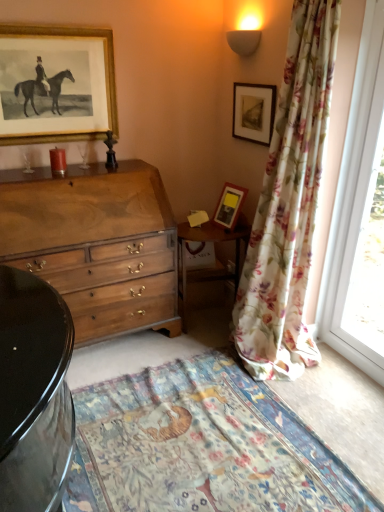
Question: Considering the positions of floral fabric curtain at right and gold-framed print at upper left, which ranks as the 3th picture frame in right-to-left order, in the image, is floral fabric curtain at right bigger or smaller than gold-framed print at upper left, which ranks as the 3th picture frame in right-to-left order,?

Choices:
 (A) big
 (B) small

Answer: (A)

Question: From the image's perspective, is floral fabric curtain at right located above or below gold-framed print at upper left, the first picture frame from the left?

Choices:
 (A) below
 (B) above

Answer: (A)

Question: Considering the real-world distances, which object is closest to the floral fabric curtain at right?

Choices:
 (A) matte wooden picture frame at upper right, the second picture frame in the right-to-left sequence
 (B) floral cotton blanket at lower center
 (C) wooden table at center
 (D) wooden chest of drawers at center
 (E) matte black picture frame at upper right, the 1th picture frame positioned from the right

Answer: (A)

Question: Based on their relative distances, which object is nearer to the wooden table at center?

Choices:
 (A) gold-framed print at upper left, the first picture frame from the left
 (B) matte black picture frame at upper right, acting as the third picture frame starting from the left
 (C) floral fabric curtain at right
 (D) matte wooden picture frame at upper right, the second picture frame in the right-to-left sequence
 (E) wooden chest of drawers at center

Answer: (D)